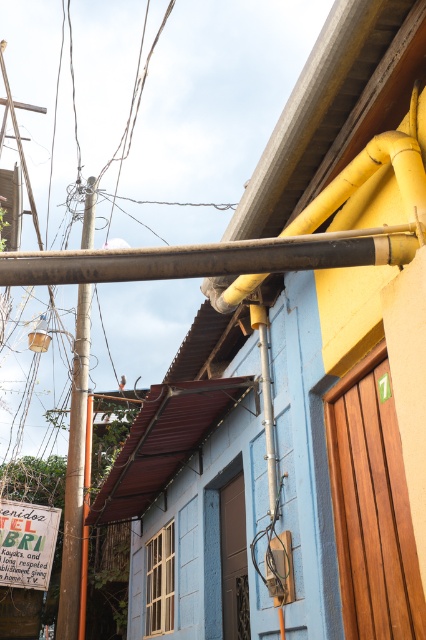
Who is positioned more to the right, black matte pipe at upper center or smooth brown pole at left?

black matte pipe at upper center

Locate an element on the screen. black matte pipe at upper center is located at coordinates (212, 257).

Where is `black matte pipe at upper center`? black matte pipe at upper center is located at coordinates (212, 257).